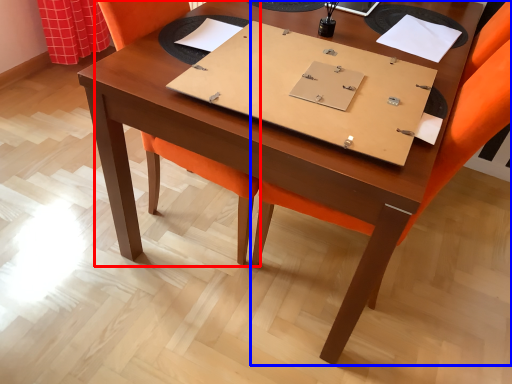
Question: Which point is further to the camera, swivel chair (highlighted by a red box) or chair (highlighted by a blue box)?

Choices:
 (A) swivel chair
 (B) chair

Answer: (A)